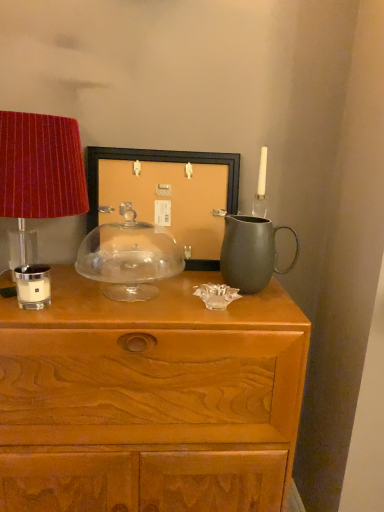
Where is `vacant area that lies to the right of velvet red lampshade at left`? Image resolution: width=384 pixels, height=512 pixels. vacant area that lies to the right of velvet red lampshade at left is located at coordinates (137, 303).